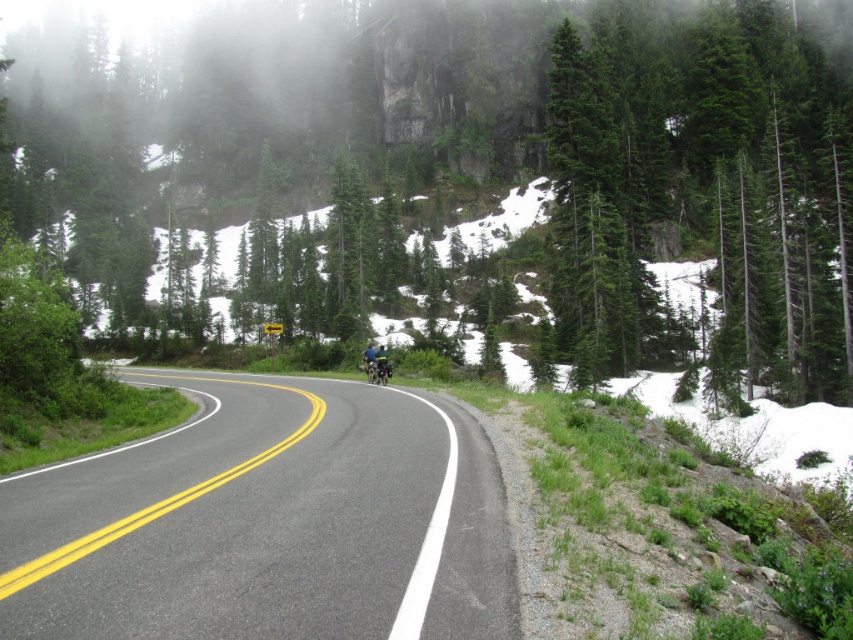
Consider the image. You are driving a car and see the road ahead with two points marked on it. The first point is at coordinate point (181, 61) and the second is at point (289, 556). Which point is closer to your car?

Point (181, 61) is closer to your car because it is further to the viewer than point (289, 556).

Based on the photo, you are driving a truck that is 4 meters tall and need to pass under the green textured tree at center and the black asphalt road at center. Which object might block your truck due to its height?

The green textured tree at center has a greater height compared to the black asphalt road at center, so it might block the truck due to its height.

You are a hiker standing at the starting point of the road. You want to reach the green textured tree at center. Which direction should you walk to get there?

The green textured tree at center is located at point (456, 176) in the image. Since you are at the starting point of the road, you should walk forward along the road as it curves gently to the left to reach the green textured tree at center.